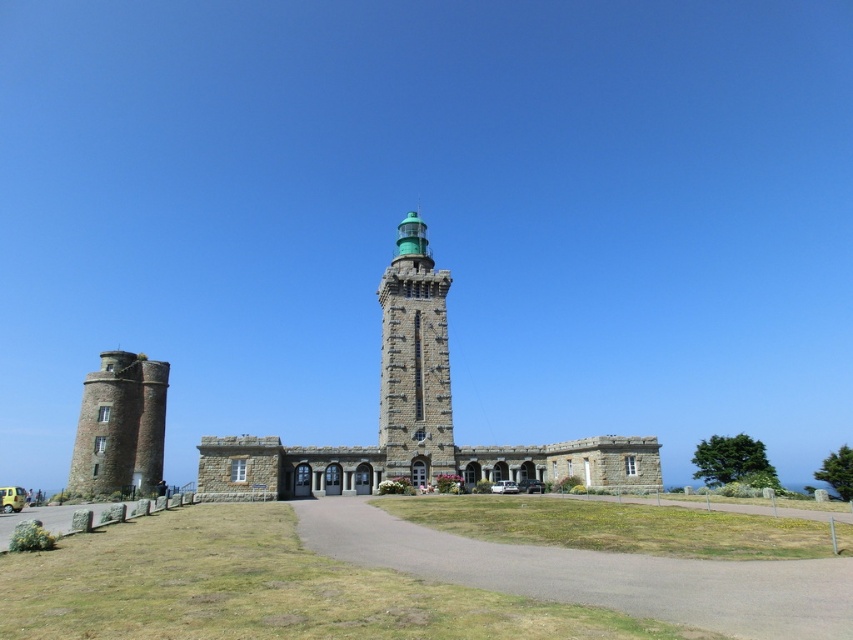
Is green stone bell tower at center closer to camera compared to stone tower at left?

Yes, green stone bell tower at center is closer to the viewer.

The width and height of the screenshot is (853, 640). I want to click on green stone bell tower at center, so click(415, 362).

Locate an element on the screen. green stone bell tower at center is located at coordinates (415, 362).

From the picture: How distant is gravel path at center from stone tower at left?

gravel path at center is 131.90 feet from stone tower at left.

Can you confirm if gravel path at center is thinner than stone tower at left?

No, gravel path at center is not thinner than stone tower at left.

Image resolution: width=853 pixels, height=640 pixels. Find the location of `gravel path at center`. gravel path at center is located at coordinates (596, 573).

At what (x,y) coordinates should I click in order to perform the action: click on gravel path at center. Please return your answer as a coordinate pair (x, y). This screenshot has width=853, height=640. Looking at the image, I should click on (596, 573).

Does point (821, 600) come closer to viewer compared to point (392, 369)?

Yes, it is.

Is gravel path at center above green stone bell tower at center?

Actually, gravel path at center is below green stone bell tower at center.

Which is behind, point (364, 508) or point (444, 392)?

Positioned behind is point (444, 392).

Where is `gravel path at center`? gravel path at center is located at coordinates (596, 573).